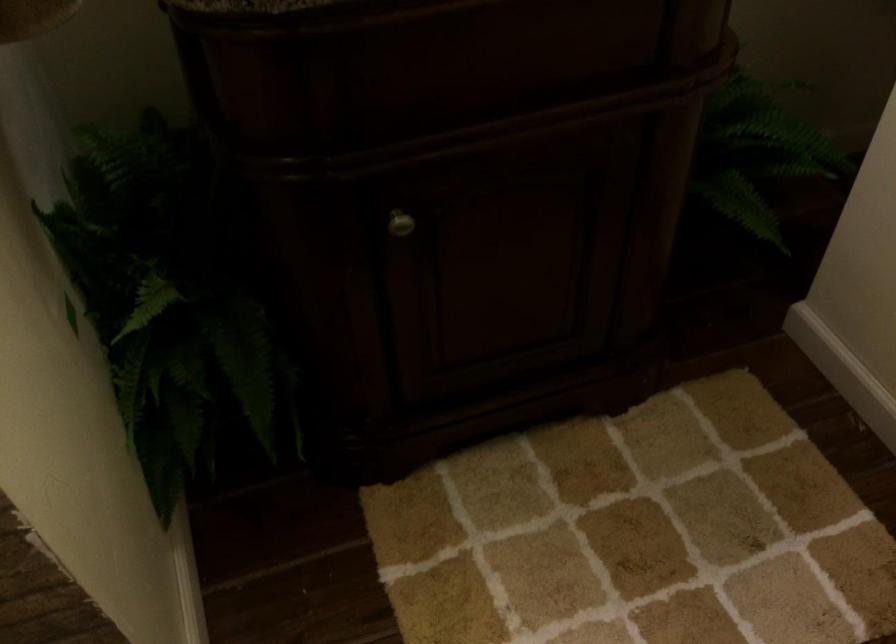
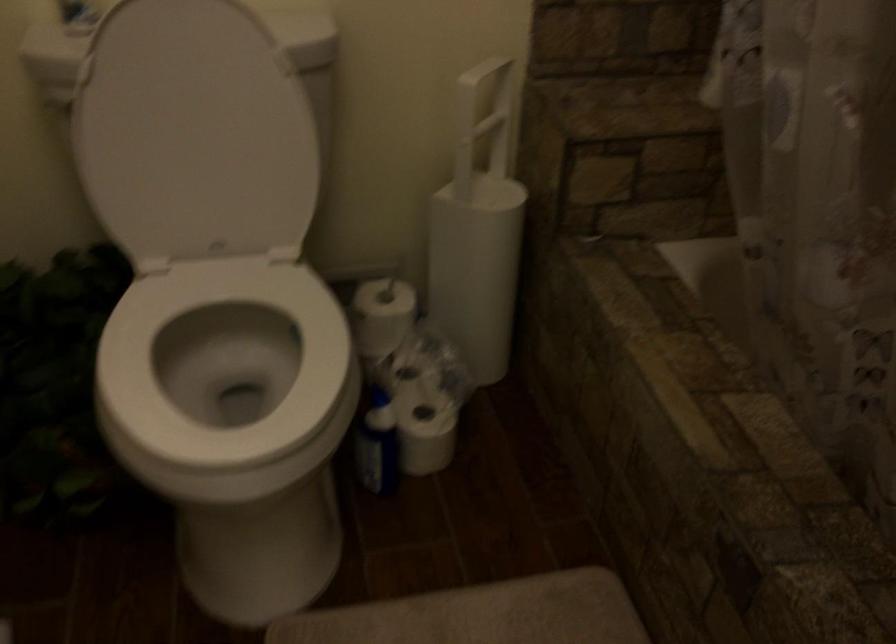
The first image is from the beginning of the video and the second image is from the end. How did the camera likely rotate when shooting the video?

The camera's rotation is toward left-down.